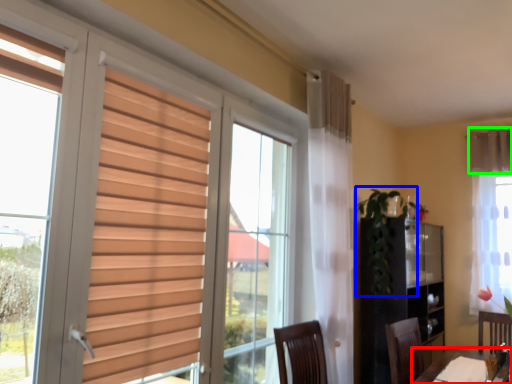
Question: Considering the real-world distances, which object is closest to table (highlighted by a red box)? plant (highlighted by a blue box) or curtain (highlighted by a green box).

Choices:
 (A) plant
 (B) curtain

Answer: (A)